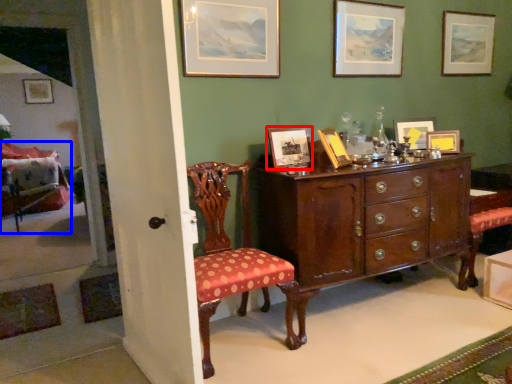
Question: Which object appears closest to the camera in this image, picture frame (highlighted by a red box) or chair (highlighted by a blue box)?

Choices:
 (A) picture frame
 (B) chair

Answer: (A)